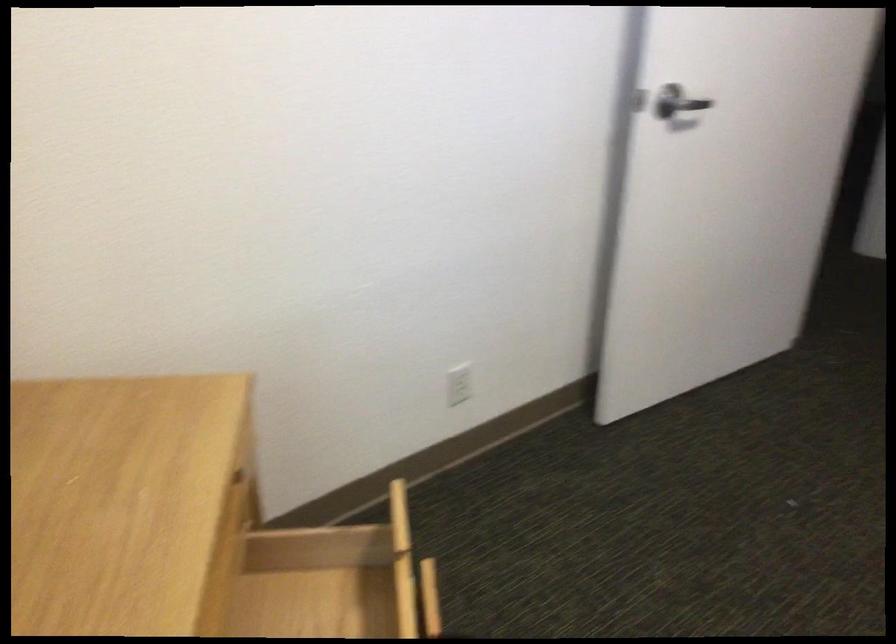
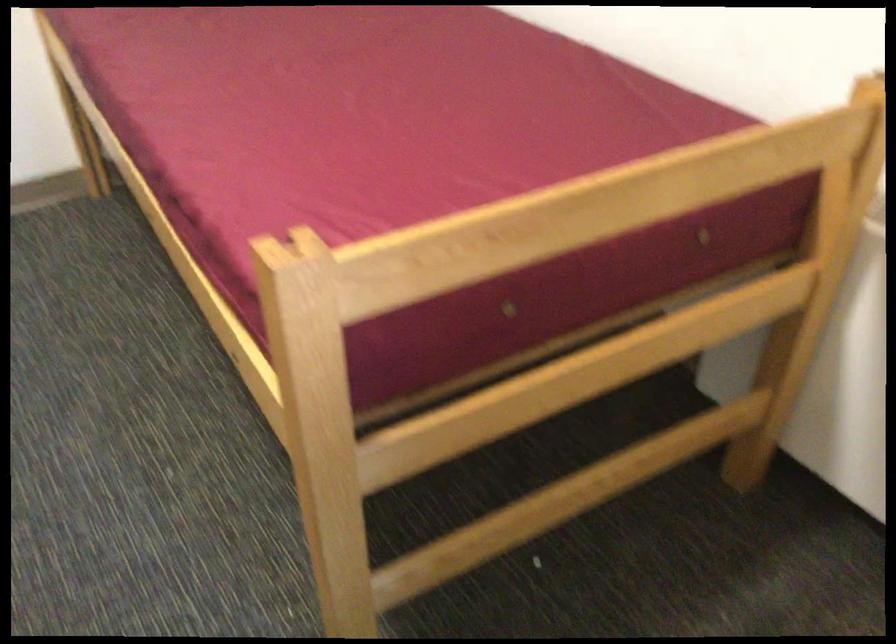
First-person continuous shooting, in which direction is the camera rotating?

The rotation direction of the camera is right-down.